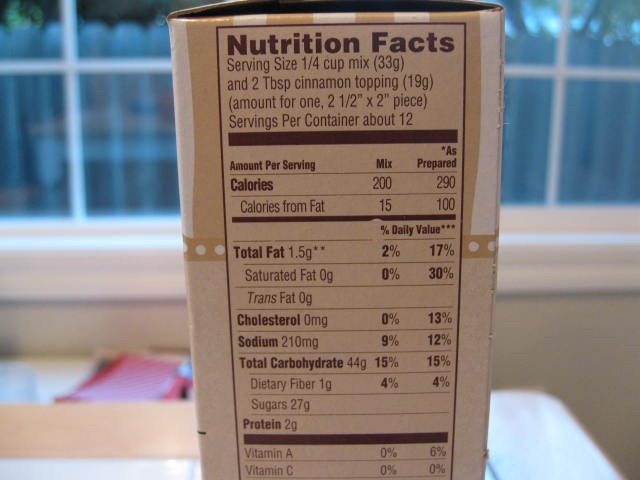
The height and width of the screenshot is (480, 640). I want to click on wall, so click(x=568, y=336).